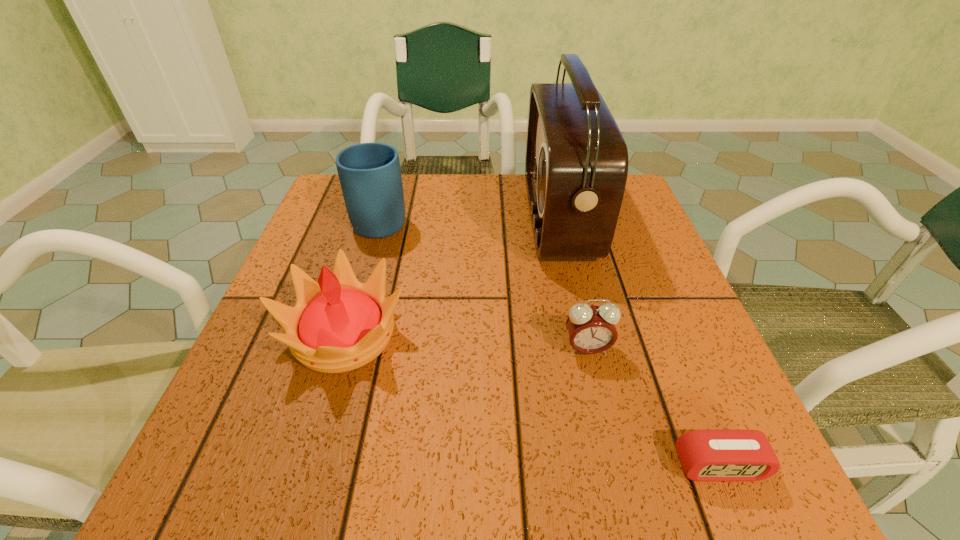
Locate which object is the second closest to the crown. Please provide its 2D coordinates. Your answer should be formatted as a tuple, i.e. [(x, y)], where the tuple contains the x and y coordinates of a point satisfying the conditions above.

[(576, 164)]